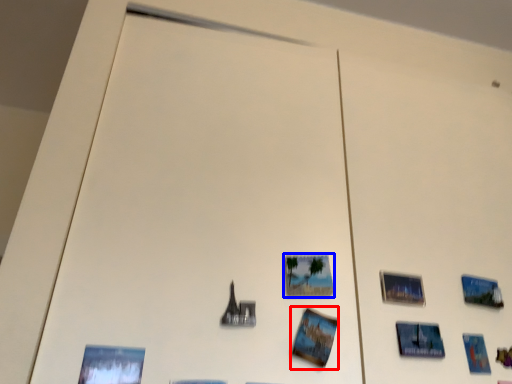
Question: Which of the following is the closest to the observer, postcard (highlighted by a red box) or picture frame (highlighted by a blue box)?

Choices:
 (A) postcard
 (B) picture frame

Answer: (A)